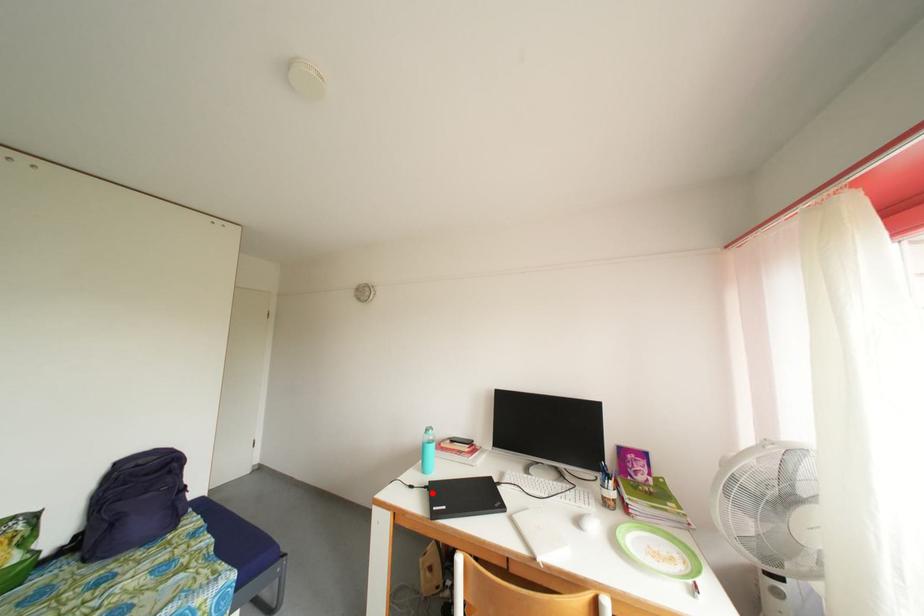
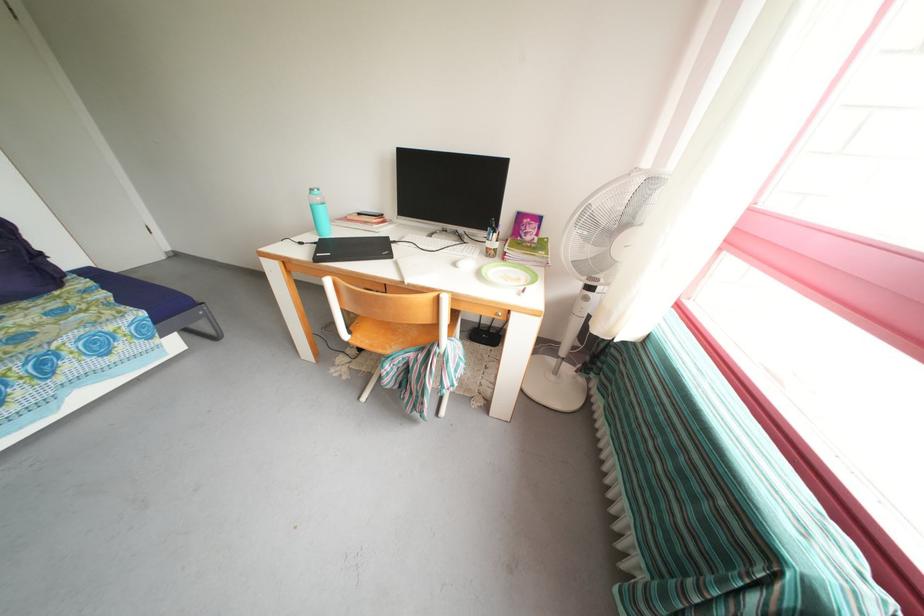
Where in the second image is the point corresponding to the highlighted location from the first image?

(322, 249)